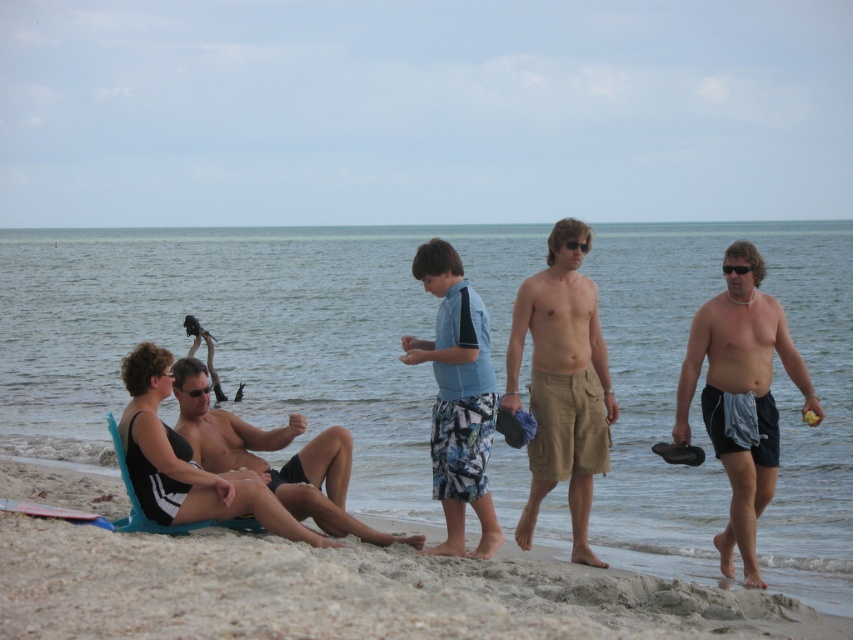
Question: Which of the following is the farthest from the observer?

Choices:
 (A) click(469, 452)
 (B) click(466, 580)
 (C) click(746, 259)

Answer: (A)

Question: Does fine-grained sand at lower left appear on the right side of tan cotton shorts at center?

Choices:
 (A) yes
 (B) no

Answer: (B)

Question: Can you confirm if fine-grained sand at lower left is thinner than gray fabric towel at right?

Choices:
 (A) yes
 (B) no

Answer: (B)

Question: Among these points, which one is nearest to the camera?

Choices:
 (A) pyautogui.click(x=42, y=540)
 (B) pyautogui.click(x=523, y=330)

Answer: (A)

Question: Is clear blue water at center above fine-grained sand at lower left?

Choices:
 (A) yes
 (B) no

Answer: (A)

Question: Which object is farther from the camera taking this photo?

Choices:
 (A) fine-grained sand at lower left
 (B) clear blue water at center
 (C) black matte swimsuit at center

Answer: (C)